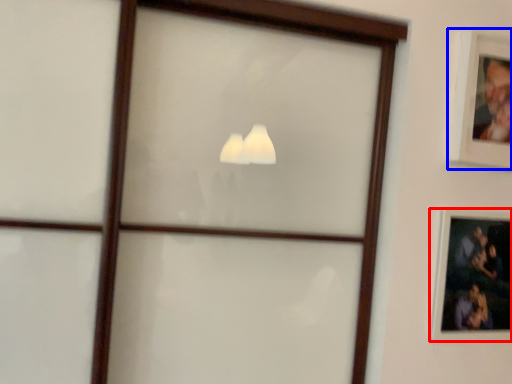
Question: Among these objects, which one is nearest to the camera, picture frame (highlighted by a red box) or picture frame (highlighted by a blue box)?

Choices:
 (A) picture frame
 (B) picture frame

Answer: (B)